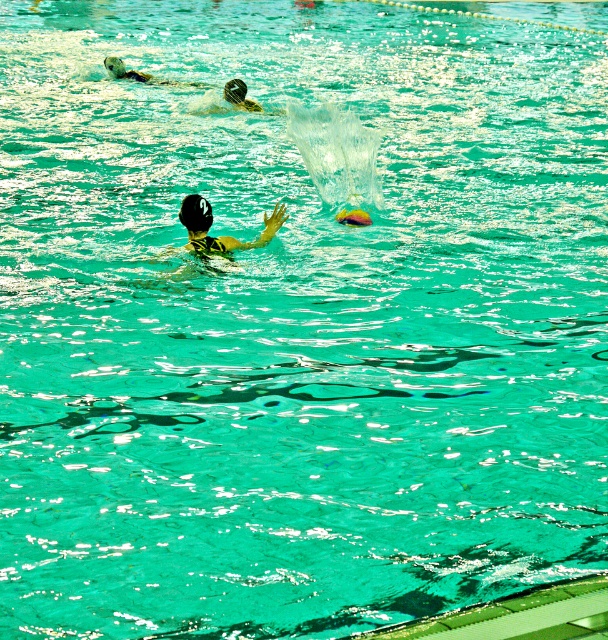
Question: Does black matte swim cap at center have a lesser width compared to black matte swim cap at upper center?

Choices:
 (A) yes
 (B) no

Answer: (A)

Question: Is yellow-green swim cap at center wider than black matte swim cap at center?

Choices:
 (A) no
 (B) yes

Answer: (B)

Question: Considering the real-world distances, which object is farthest from the black matte swim cap at upper center?

Choices:
 (A) yellow-green swim cap at center
 (B) black matte swim cap at center

Answer: (B)

Question: Which point is farther from the camera taking this photo?

Choices:
 (A) (207, 202)
 (B) (195, 212)

Answer: (A)

Question: Is yellow-green swim cap at center wider than white matte swim cap at upper left?

Choices:
 (A) no
 (B) yes

Answer: (B)

Question: Estimate the real-world distances between objects in this image. Which object is farther from the yellow-green swim cap at center?

Choices:
 (A) black matte swim cap at upper center
 (B) white matte swim cap at upper left
 (C) black matte swim cap at center

Answer: (B)